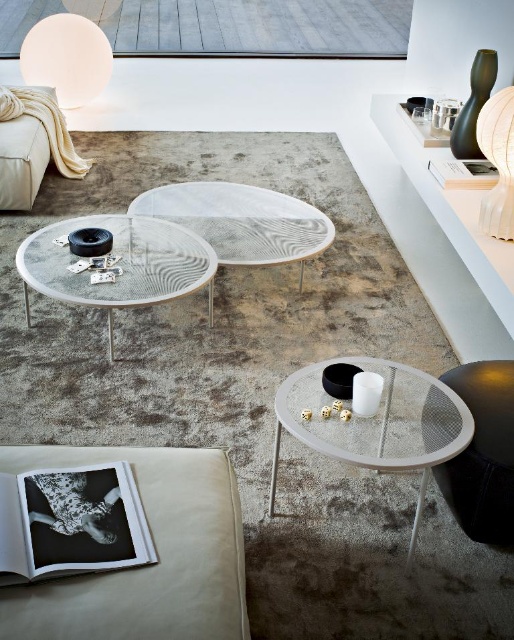
You are a guest entering the living room and want to sit on the beige leather couch at lower left. Can you easily reach the transparent mesh side table at center from there without moving your legs?

The beige leather couch at lower left is shorter than the transparent mesh side table at center, so you might have difficulty reaching the table comfortably without adjusting your position.